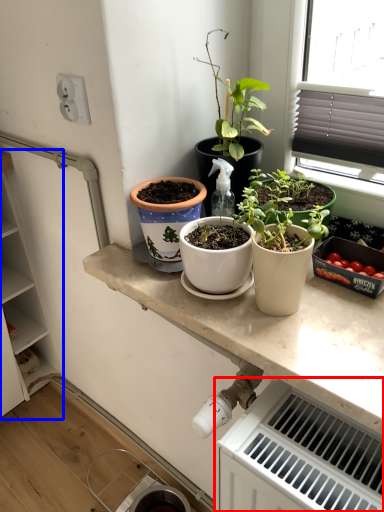
Question: Which object is closer to the camera taking this photo, radiator (highlighted by a red box) or cabinetry (highlighted by a blue box)?

Choices:
 (A) radiator
 (B) cabinetry

Answer: (A)